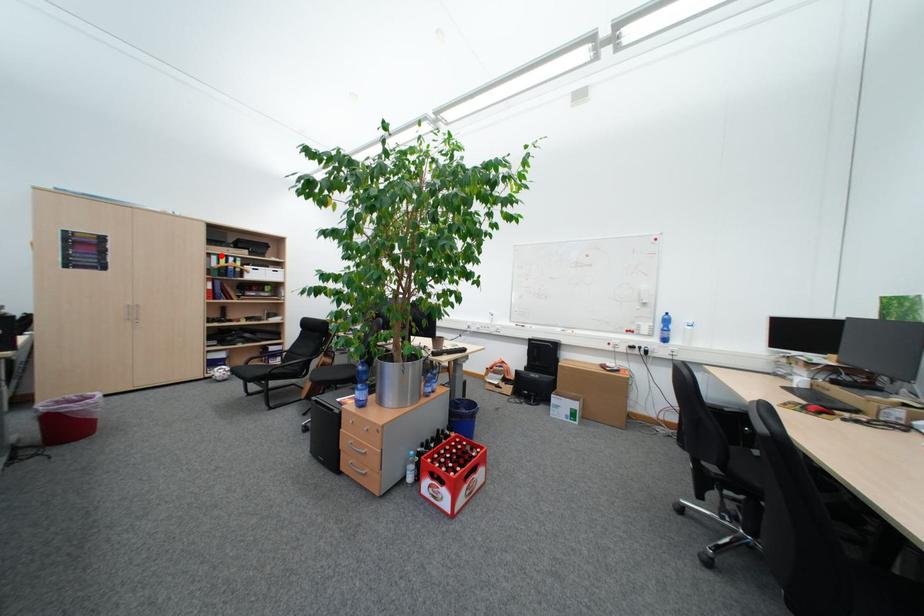
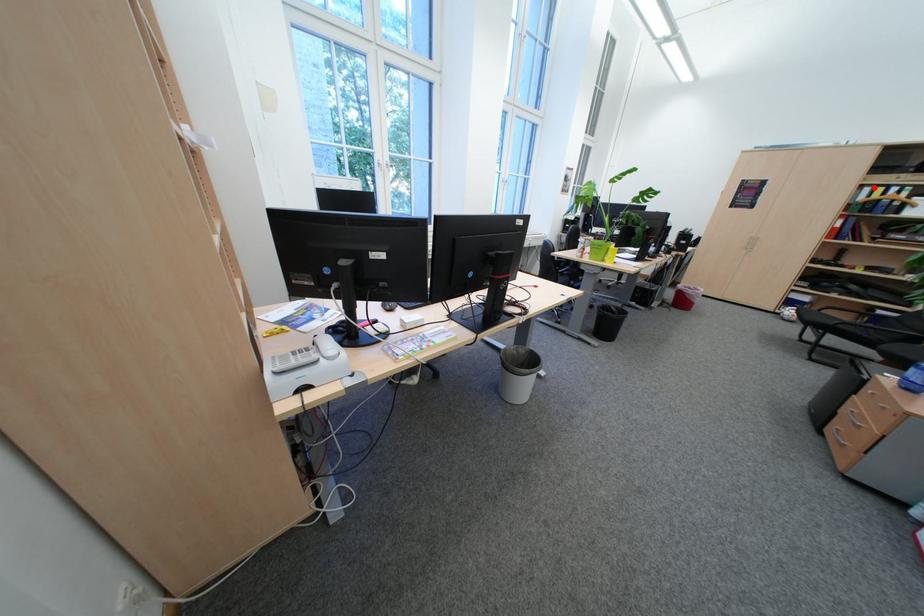
I am providing you with two images of the same scene from different viewpoints. A red point is marked on the first image and another point is marked on the second image. Are the points marked in image1 and image2 representing the same 3D position?

Yes